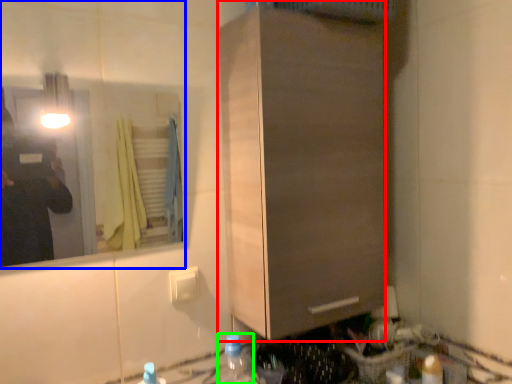
Question: Estimate the real-world distances between objects in this image. Which object is farther from cabinetry (highlighted by a red box), mirror (highlighted by a blue box) or bottle (highlighted by a green box)?

Choices:
 (A) mirror
 (B) bottle

Answer: (A)